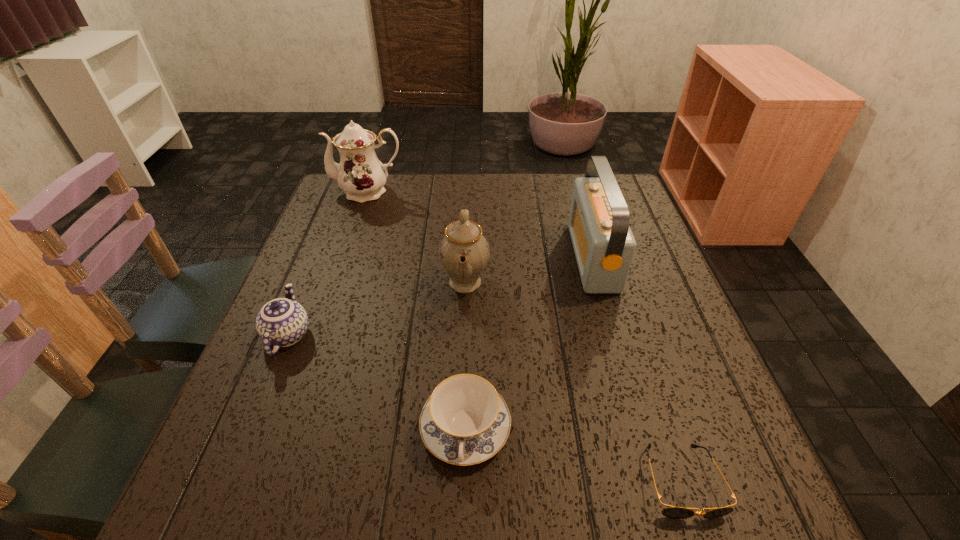
This screenshot has width=960, height=540. Identify the location of the farthest object. (361, 175).

Locate an element on the screen. radio receiver is located at coordinates (604, 245).

Find the location of a particular element. The height and width of the screenshot is (540, 960). the second shortest chinaware is located at coordinates (282, 322).

Locate an element on the screen. The width and height of the screenshot is (960, 540). the nearest chinaware is located at coordinates (465, 421).

Identify the location of the second shortest object. This screenshot has height=540, width=960. (465, 421).

I want to click on sunglasses, so click(x=674, y=512).

What are the coordinates of `vacant space situated on the right of the farthest object` in the screenshot? It's located at (505, 192).

Where is `vacant space situated 0.090m on the front-facing side of the radio receiver`? The height and width of the screenshot is (540, 960). vacant space situated 0.090m on the front-facing side of the radio receiver is located at coordinates click(x=539, y=257).

Where is `vacant space located on the front-facing side of the radio receiver`? vacant space located on the front-facing side of the radio receiver is located at coordinates (438, 257).

The width and height of the screenshot is (960, 540). I want to click on vacant area situated on the front-facing side of the radio receiver, so click(518, 257).